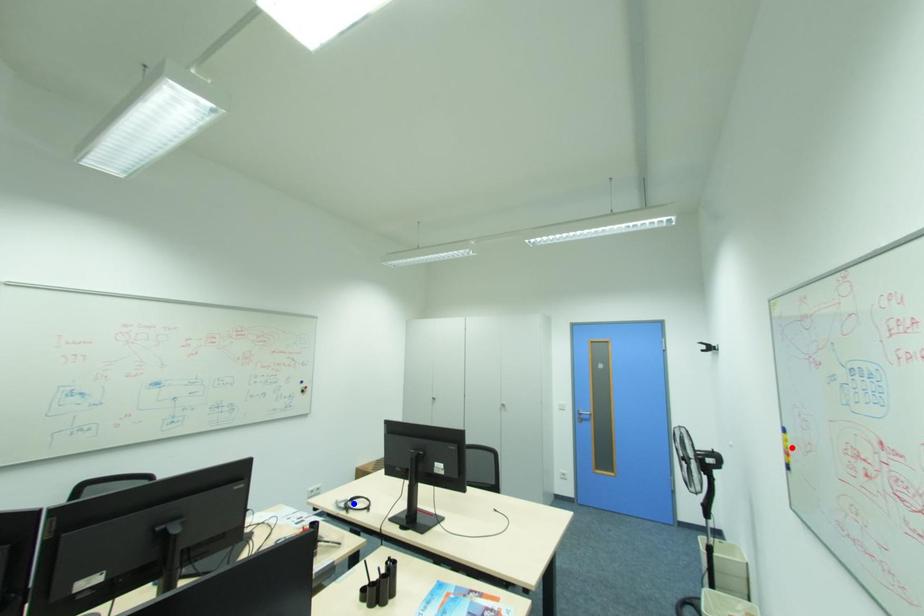
Question: In the image, two points are highlighted. Which point is nearer to the camera? Reply with the corresponding letter.

Choices:
 (A) blue point
 (B) red point

Answer: (B)